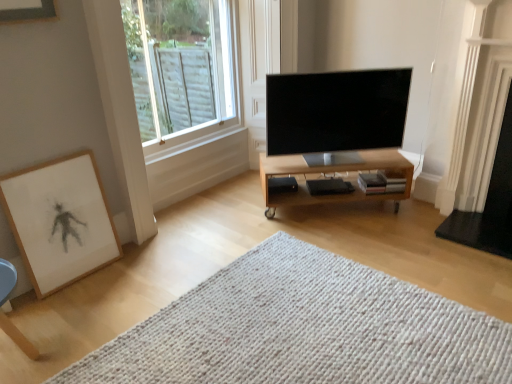
Locate an element on the screen. The width and height of the screenshot is (512, 384). free space above black matte speaker at center (from a real-world perspective) is located at coordinates (281, 186).